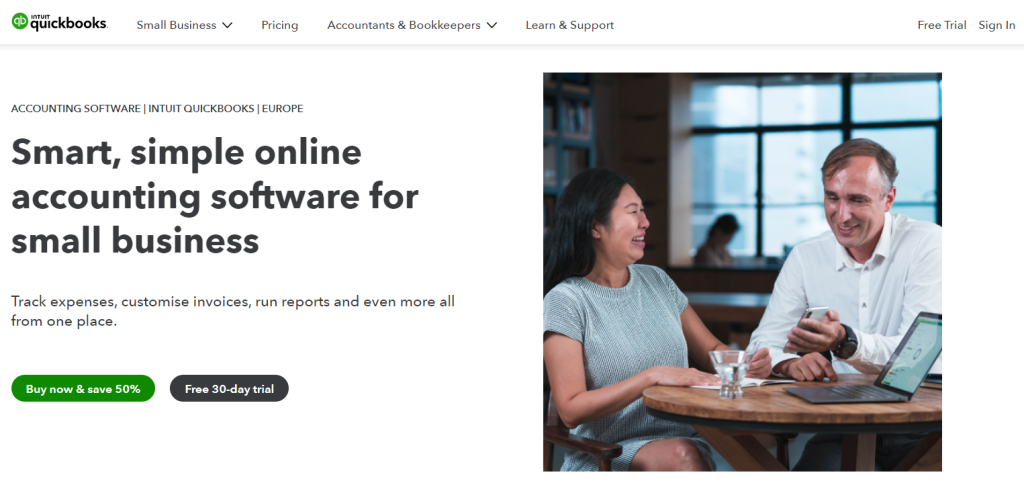
The height and width of the screenshot is (489, 1024). Identify the location of woman's right hand flat on table. (684, 369).